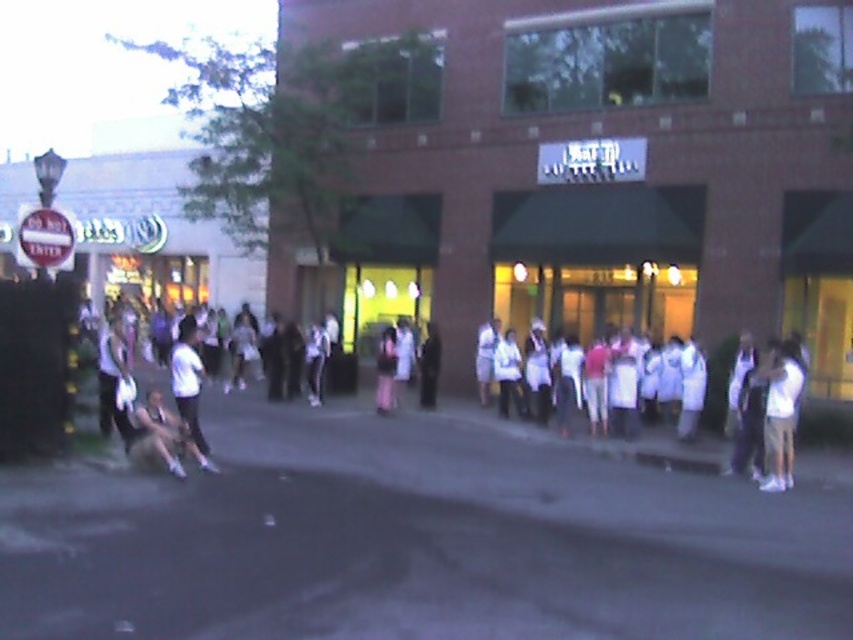
Question: Which point is closer to the camera?

Choices:
 (A) (715, 157)
 (B) (770, 376)

Answer: (B)

Question: Considering the real-world distances, which object is closest to the dark clothing at center?

Choices:
 (A) white cotton shirt at center
 (B) white cloth at center
 (C) white matte shirt at center
 (D) white athletic wear at lower left

Answer: (A)

Question: In this image, where is white cloth at center located relative to white cotton shirt at right?

Choices:
 (A) below
 (B) above

Answer: (B)

Question: Can you confirm if brick building at center is wider than white cotton shirt at center?

Choices:
 (A) yes
 (B) no

Answer: (A)

Question: Among these objects, which one is nearest to the camera?

Choices:
 (A) white cotton shirt at right
 (B) white athletic wear at lower left
 (C) brick building at center

Answer: (B)

Question: Is white matte shirt at center below dark clothing at center?

Choices:
 (A) no
 (B) yes

Answer: (A)